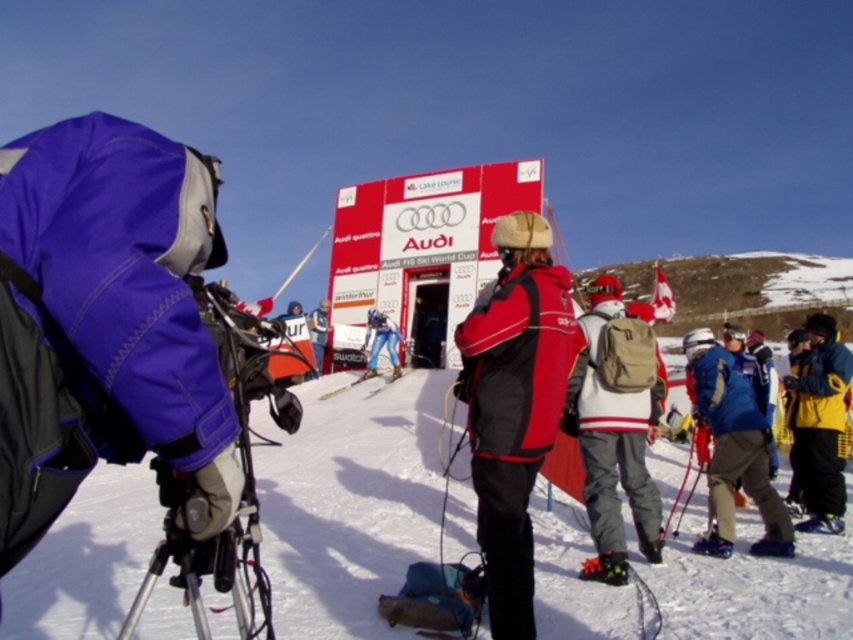
You are a photographer positioned at the bottom of the slope. You want to take a photo of the yellow jacket at center and the white metallic ski at center. Which object will appear larger in your photo?

The yellow jacket at center will appear larger in the photo because it is closer to the viewer than the white metallic ski at center.

You are standing at the base of the snowy slope and want to reach the point marked at coordinates point (459, 428). Given that your maximum comfortable walking distance is 150 feet, can you comfortably walk to that point without needing assistance?

The distance of point (459, 428) from viewer is 164.69 feet, which exceeds your maximum comfortable walking distance of 150 feet. Therefore, you may need assistance to reach that point.